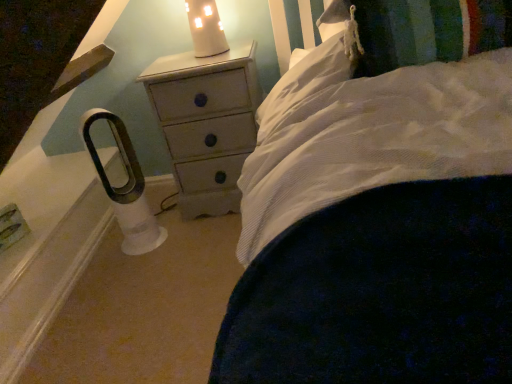
Question: Is white soft pillow at upper right thinner than white painted wood chest of drawers at center?

Choices:
 (A) no
 (B) yes

Answer: (B)

Question: Does white soft pillow at upper right appear on the right side of white painted wood chest of drawers at center?

Choices:
 (A) no
 (B) yes

Answer: (B)

Question: Is white soft pillow at upper right to the left of white painted wood chest of drawers at center from the viewer's perspective?

Choices:
 (A) yes
 (B) no

Answer: (B)

Question: Is white soft pillow at upper right behind white painted wood chest of drawers at center?

Choices:
 (A) no
 (B) yes

Answer: (A)

Question: From a real-world perspective, is white soft pillow at upper right under white painted wood chest of drawers at center?

Choices:
 (A) yes
 (B) no

Answer: (B)

Question: Does white soft pillow at upper right come in front of white painted wood chest of drawers at center?

Choices:
 (A) yes
 (B) no

Answer: (A)

Question: Is white ceramic candle at upper center looking in the opposite direction of white painted wood chest of drawers at center?

Choices:
 (A) no
 (B) yes

Answer: (A)

Question: Are white ceramic candle at upper center and white painted wood chest of drawers at center far apart?

Choices:
 (A) no
 (B) yes

Answer: (A)

Question: Would you say white painted wood chest of drawers at center is part of white ceramic candle at upper center's contents?

Choices:
 (A) yes
 (B) no

Answer: (B)

Question: Considering the relative positions of white ceramic candle at upper center and white painted wood chest of drawers at center in the image provided, is white ceramic candle at upper center to the left of white painted wood chest of drawers at center from the viewer's perspective?

Choices:
 (A) yes
 (B) no

Answer: (A)

Question: Considering the relative positions of white ceramic candle at upper center and white painted wood chest of drawers at center in the image provided, is white ceramic candle at upper center to the right of white painted wood chest of drawers at center from the viewer's perspective?

Choices:
 (A) yes
 (B) no

Answer: (B)

Question: Considering the relative positions of white ceramic candle at upper center and white painted wood chest of drawers at center in the image provided, is white ceramic candle at upper center behind white painted wood chest of drawers at center?

Choices:
 (A) no
 (B) yes

Answer: (A)

Question: Is white soft pillow at upper right oriented towards white ceramic candle at upper center?

Choices:
 (A) yes
 (B) no

Answer: (B)